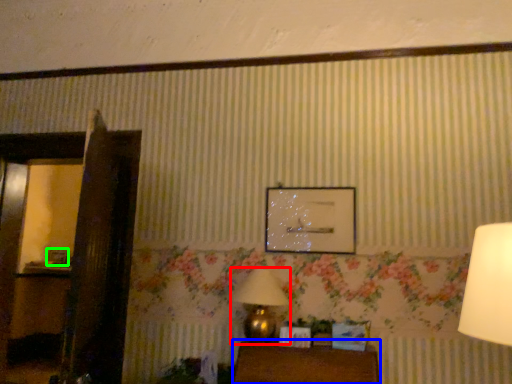
Question: Which object is positioned closest to table lamp (highlighted by a red box)? Select from furniture (highlighted by a blue box) and picture frame (highlighted by a green box).

Choices:
 (A) furniture
 (B) picture frame

Answer: (A)